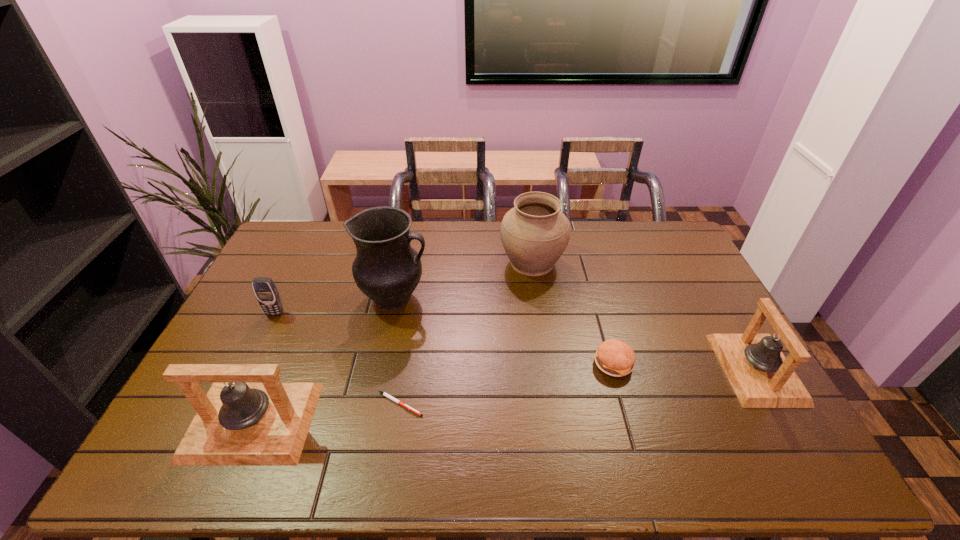
Identify which object is located as the nearest to the shortest object. Please provide its 2D coordinates. Your answer should be formatted as a tuple, i.e. [(x, y)], where the tuple contains the x and y coordinates of a point satisfying the conditions above.

[(237, 424)]

Identify which object is located as the fifth nearest to the fifth tallest object. Please provide its 2D coordinates. Your answer should be formatted as a tuple, i.e. [(x, y)], where the tuple contains the x and y coordinates of a point satisfying the conditions above.

[(614, 357)]

The image size is (960, 540). What are the coordinates of `vacant area that satisfies the following two spatial constraints: 1. on the front face of the left bell; 2. on the right side of the cellular telephone` in the screenshot? It's located at (223, 422).

Identify the location of free space that satisfies the following two spatial constraints: 1. on the front side of the fifth object from left to right; 2. on the handle side of the tallest object. (537, 298).

Where is `vacant region that satisfies the following two spatial constraints: 1. on the handle side of the sixth tallest object; 2. on the right side of the pitcher`? The height and width of the screenshot is (540, 960). vacant region that satisfies the following two spatial constraints: 1. on the handle side of the sixth tallest object; 2. on the right side of the pitcher is located at coordinates (381, 364).

Image resolution: width=960 pixels, height=540 pixels. Find the location of `vacant space that satisfies the following two spatial constraints: 1. on the back side of the sixth tallest object; 2. on the handle side of the pitcher`. vacant space that satisfies the following two spatial constraints: 1. on the back side of the sixth tallest object; 2. on the handle side of the pitcher is located at coordinates (595, 298).

This screenshot has width=960, height=540. Identify the location of free space that satisfies the following two spatial constraints: 1. on the front face of the cellular telephone; 2. on the left side of the rightmost object. (249, 369).

The width and height of the screenshot is (960, 540). Find the location of `free spot that satisfies the following two spatial constraints: 1. on the handle side of the hamburger; 2. on the right side of the pitcher`. free spot that satisfies the following two spatial constraints: 1. on the handle side of the hamburger; 2. on the right side of the pitcher is located at coordinates (381, 364).

Where is `free space that satisfies the following two spatial constraints: 1. on the handle side of the pitcher; 2. on the front face of the cellular telephone`? This screenshot has height=540, width=960. free space that satisfies the following two spatial constraints: 1. on the handle side of the pitcher; 2. on the front face of the cellular telephone is located at coordinates 392,313.